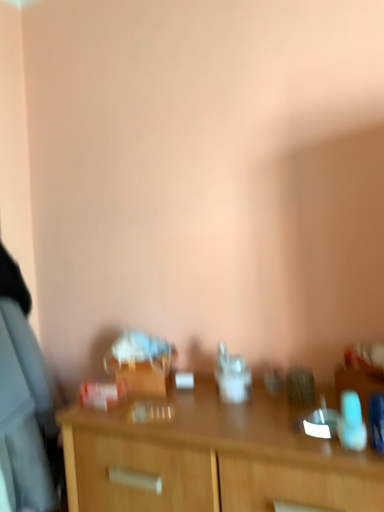
Where is `gray fabric swivel chair at left`? gray fabric swivel chair at left is located at coordinates (24, 414).

This screenshot has width=384, height=512. Describe the element at coordinates (24, 414) in the screenshot. I see `gray fabric swivel chair at left` at that location.

This screenshot has height=512, width=384. Identify the location of gray fabric swivel chair at left. (24, 414).